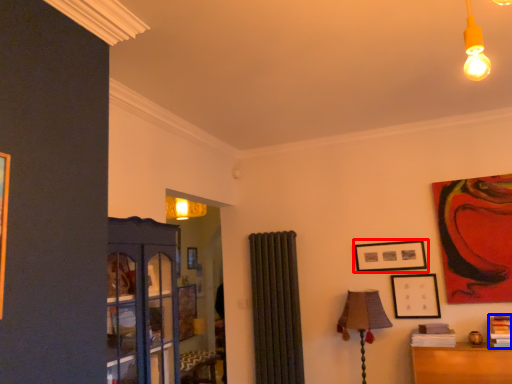
Question: Which of the following is the closest to the observer, picture frame (highlighted by a red box) or book (highlighted by a blue box)?

Choices:
 (A) picture frame
 (B) book

Answer: (B)